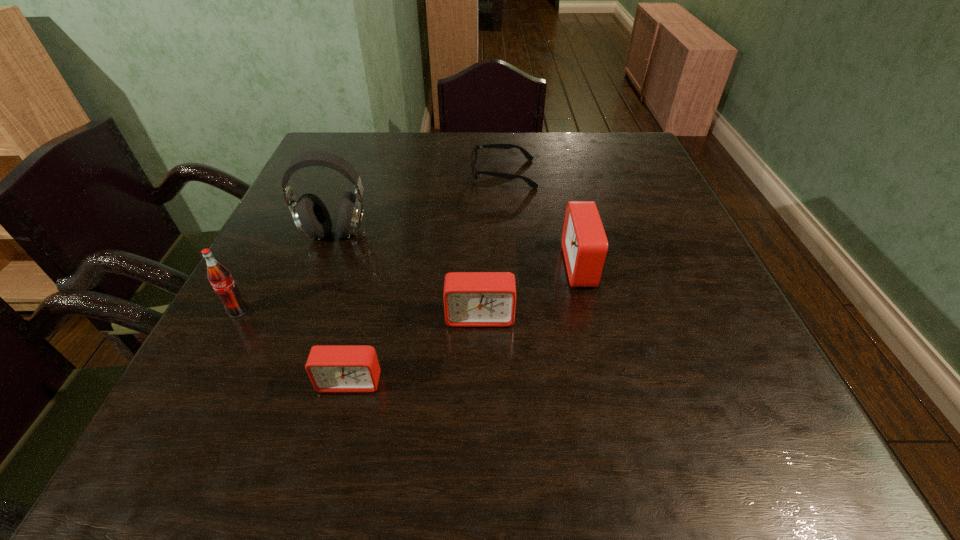
Locate an element on the screen. The image size is (960, 540). object located at the far edge is located at coordinates (531, 183).

The image size is (960, 540). What are the coordinates of `object that is at the near edge` in the screenshot? It's located at (331, 368).

Identify the location of soda bottle that is at the left edge. The image size is (960, 540). (220, 278).

At what (x,y) coordinates should I click in order to perform the action: click on headset located in the left edge section of the desktop. Please return your answer as a coordinate pair (x, y). The image size is (960, 540). Looking at the image, I should click on (309, 213).

Where is `free region at the far edge of the desktop`? Image resolution: width=960 pixels, height=540 pixels. free region at the far edge of the desktop is located at coordinates (547, 147).

At what (x,y) coordinates should I click in order to perform the action: click on vacant space at the near edge of the desktop. Please return your answer as a coordinate pair (x, y). Looking at the image, I should click on (534, 374).

Locate an element on the screen. The height and width of the screenshot is (540, 960). free space at the left edge of the desktop is located at coordinates (318, 255).

In the image, there is a desktop. Where is `free space at the right edge`? Image resolution: width=960 pixels, height=540 pixels. free space at the right edge is located at coordinates (647, 215).

At what (x,y) coordinates should I click in order to perform the action: click on vacant region at the far left corner of the desktop. Please return your answer as a coordinate pair (x, y). This screenshot has width=960, height=540. Looking at the image, I should click on (337, 133).

In the image, there is a desktop. At what (x,y) coordinates should I click in order to perform the action: click on free space at the far right corner. Please return your answer as a coordinate pair (x, y). Looking at the image, I should click on (639, 143).